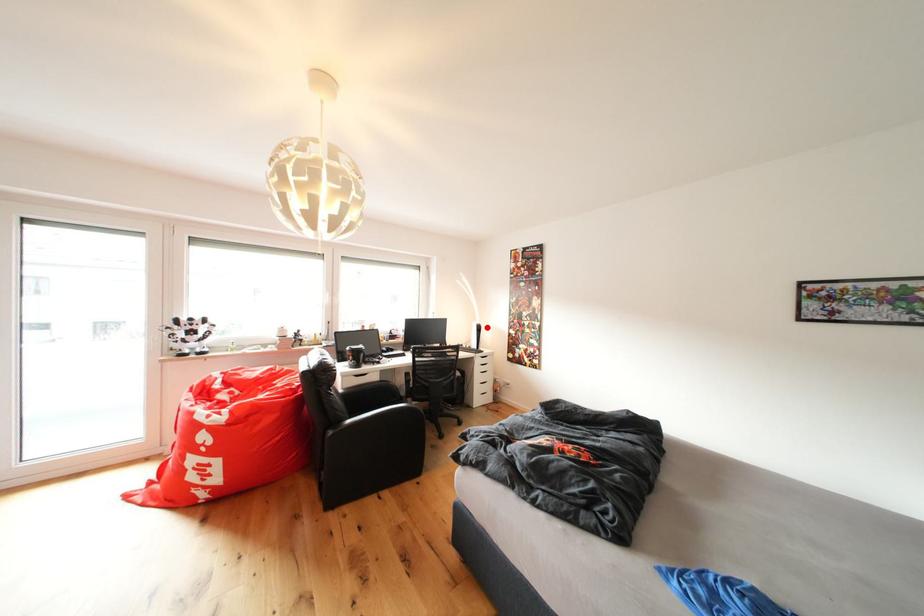
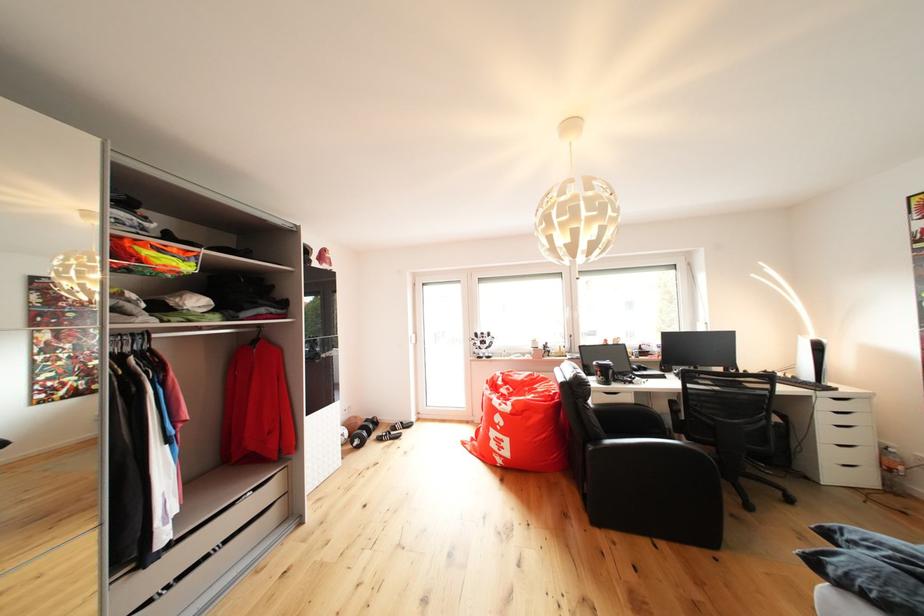
The point at the highlighted location is marked in the first image. Where is the corresponding point in the second image?

(822, 342)